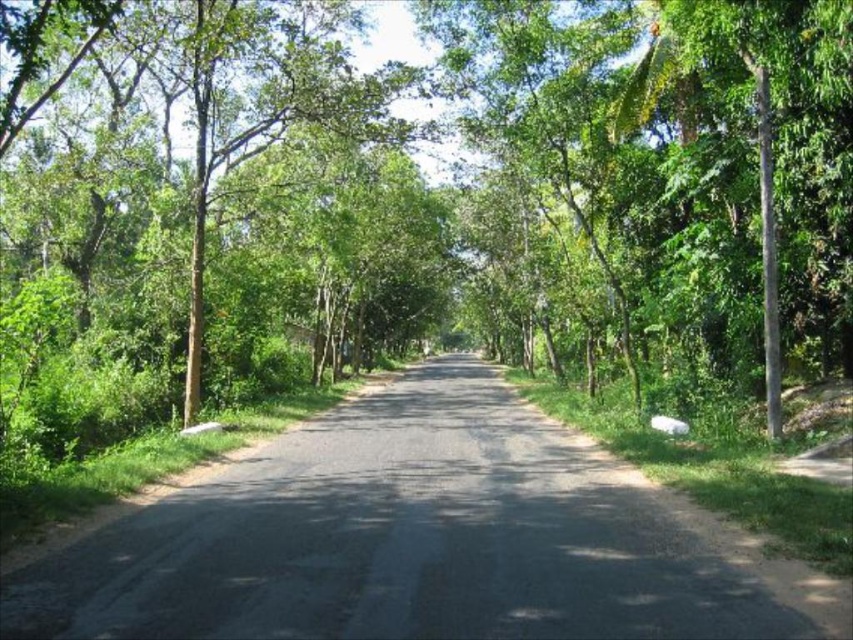
You are standing on the black asphalt road at center and want to reach the green leafy tree at center. Which direction should you walk to get there?

The green leafy tree at center is positioned on the left side of black asphalt road at center, so you should walk to the left to reach it.

You are driving a car that is 2 meters wide. You come across the black asphalt road at center flanked by the green leafy tree at left. Can your car pass through the road without hitting the tree?

The black asphalt road at center has a lesser width compared to green leafy tree at left. Since the road is narrower than the tree, it might not be wide enough for a 2m car to pass safely without hitting the tree.

Consider the image. You are standing on the road and see two green leafy trees. Which one is more to the left, the green leafy tree at center or the green leafy tree at left?

The green leafy tree at left is more to the left because it is positioned on the left side of the green leafy tree at center.